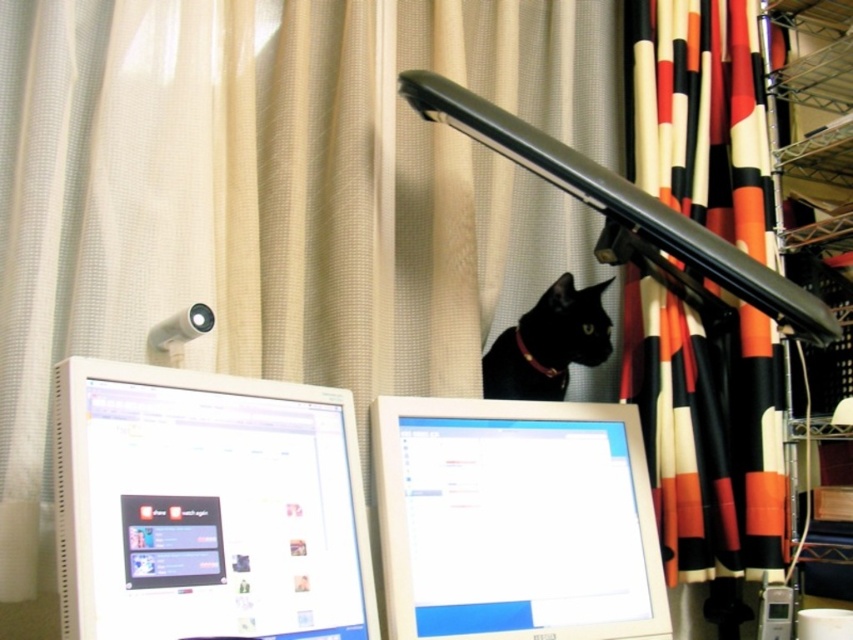
You are trying to decide which monitor to use for a presentation. The white glossy computer monitor at lower left and the white glossy computer monitor at center are both available. Which one has a larger screen size?

The white glossy computer monitor at center has a larger screen size than the white glossy computer monitor at lower left.

You are standing in front of the desk with the white glossy computer monitor at center. If you want to reach the monitor without moving your feet, can you touch it with your outstretched hand?

The white glossy computer monitor at center is 3.32 feet away from the viewer. Since the average human arm span is about 3 feet, you might be able to just barely touch it with your fingertips if you stretch out your arm fully.